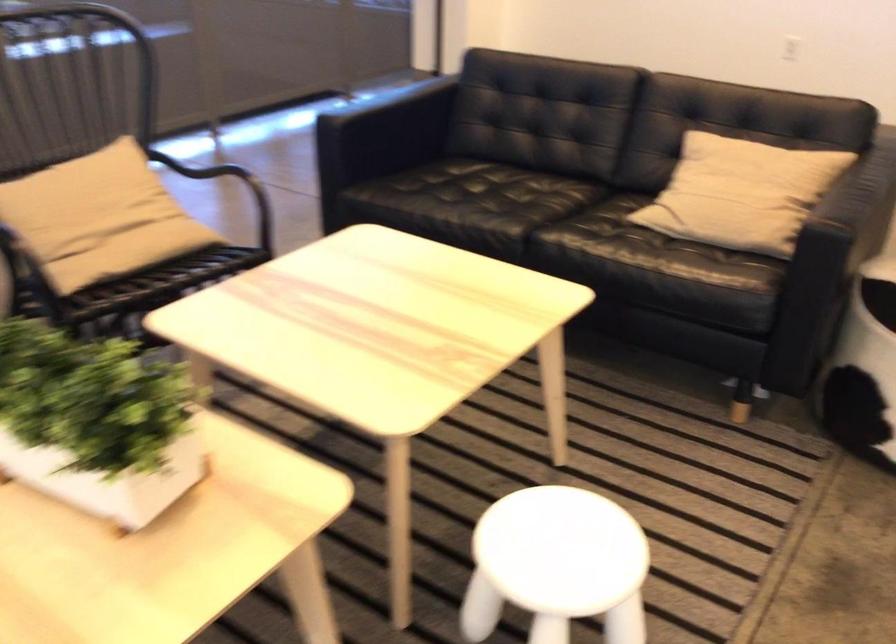
The height and width of the screenshot is (644, 896). Describe the element at coordinates (151, 254) in the screenshot. I see `the chair sitting surface` at that location.